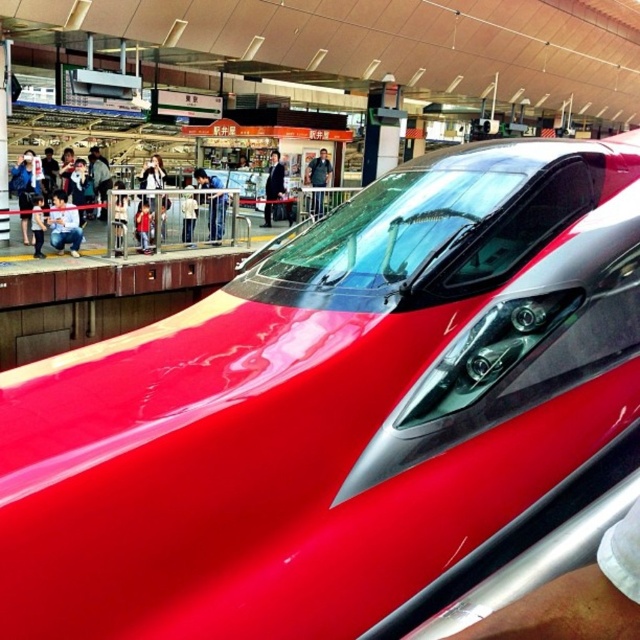
You are a photographer standing on the platform at the train station. You notice a person wearing jeans at left and another wearing dark blue shirt at center. Which clothing item is lower in the image?

The jeans at left is positioned under the dark blue shirt at center, so the jeans at left is lower in the image.

You are a photographer standing on the platform at the train station. You want to take a photo of the black suit at center without including the jeans at left in the frame. Is it possible to do so by moving your position? Explain your reasoning.

Answer: The jeans at left is in front of the black suit at center, so moving your position could allow you to angle the camera around the jeans at left to capture the black suit at center alone. However, this depends on the distance between them and the photographer.